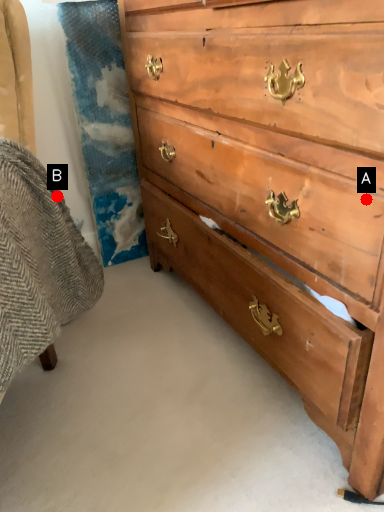
Question: Two points are circled on the image, labeled by A and B beside each circle. Which of the following is the closest to the observer?

Choices:
 (A) A is closer
 (B) B is closer

Answer: (A)